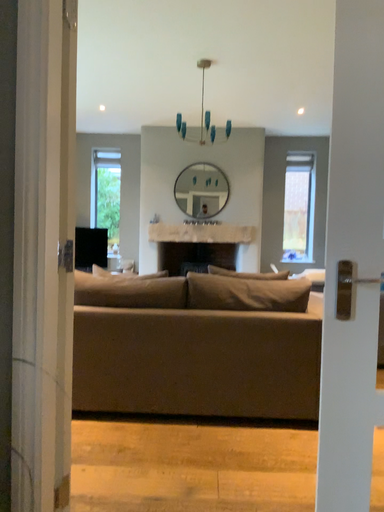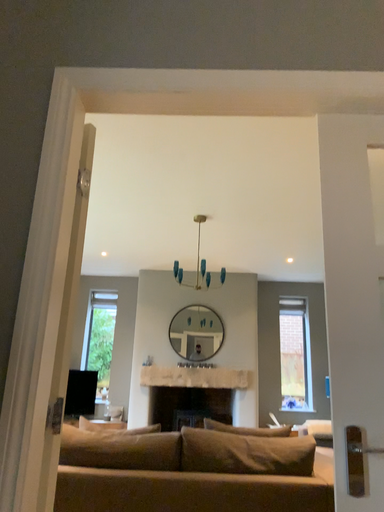
Question: Which way did the camera rotate in the video?

Choices:
 (A) rotated downward
 (B) rotated upward

Answer: (B)